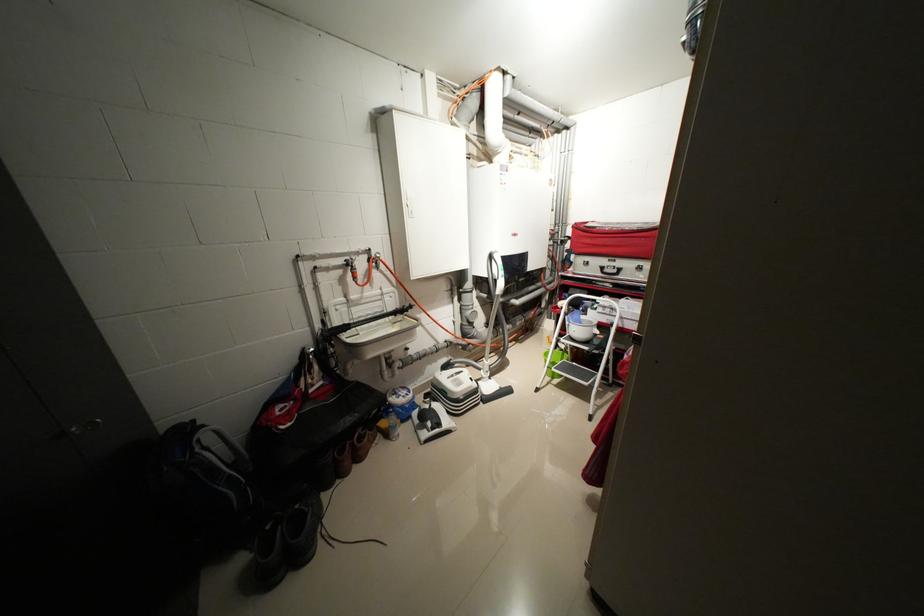
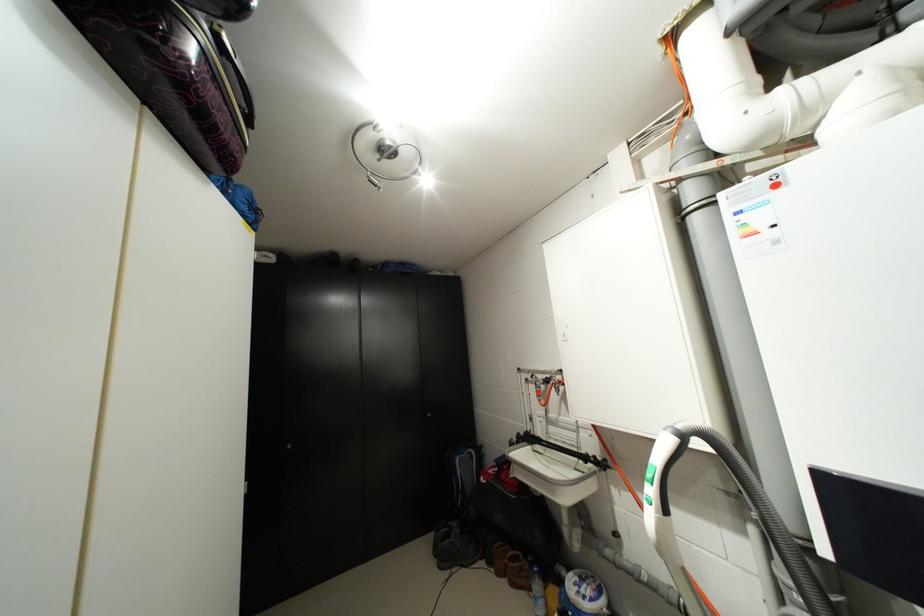
Find the pixel in the second image that matches (353,475) in the first image.

(505, 575)